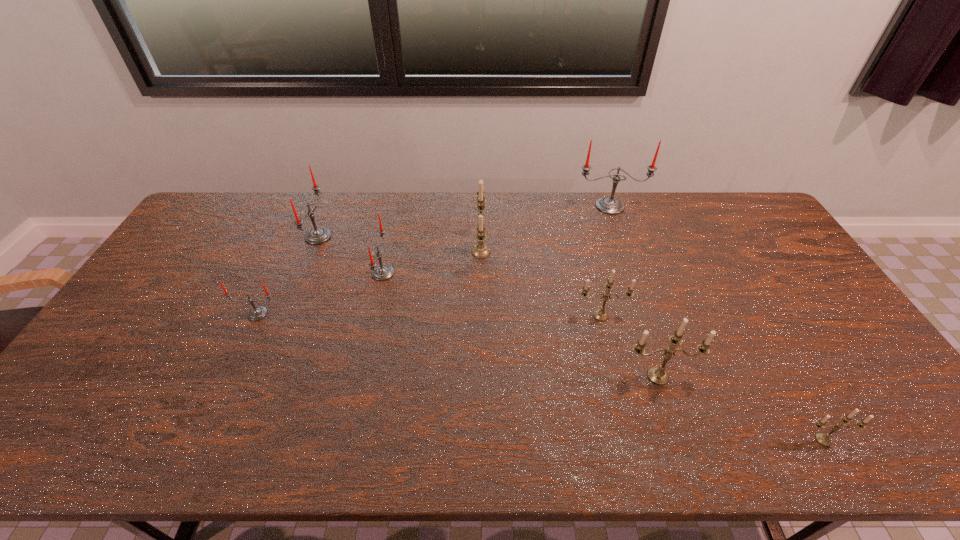
At what (x,y) coordinates should I click in order to perform the action: click on the nearest red candle. Please return your answer as a coordinate pair (x, y). Looking at the image, I should click on (257, 313).

The height and width of the screenshot is (540, 960). In order to click on the nearest candle in this screenshot , I will do `click(824, 439)`.

The height and width of the screenshot is (540, 960). I want to click on the rightmost object, so click(824, 439).

Locate an element on the screen. The image size is (960, 540). free space located on the front-facing side of the farthest object is located at coordinates (641, 296).

In order to click on blank area located 0.100m on the right of the fifth object from right to left in this screenshot , I will do `click(521, 252)`.

In order to click on free space located 0.180m on the front-facing side of the second biggest red candle in this screenshot , I will do `click(383, 237)`.

At what (x,y) coordinates should I click in order to perform the action: click on free space located 0.110m on the front of the second nearest metallic candle. Please return your answer as a coordinate pair (x, y). This screenshot has width=960, height=540. Looking at the image, I should click on (675, 427).

Where is `vacant space located on the front-facing side of the sixth object from right to left`? vacant space located on the front-facing side of the sixth object from right to left is located at coordinates (464, 273).

Locate an element on the screen. Image resolution: width=960 pixels, height=540 pixels. blank area located on the right of the second smallest metallic candle is located at coordinates (745, 315).

Where is `blank space located 0.380m on the front-facing side of the smallest red candle`? blank space located 0.380m on the front-facing side of the smallest red candle is located at coordinates (193, 454).